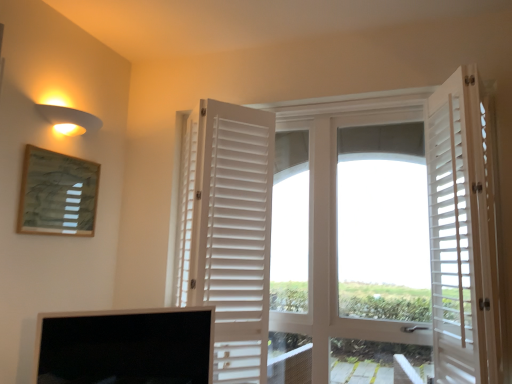
Question: Is the surface of wooden textured picture frame at upper left in direct contact with white wooden shutters at right, positioned as the first door in right-to-left order?

Choices:
 (A) no
 (B) yes

Answer: (A)

Question: Is wooden textured picture frame at upper left not close to white wooden shutters at right, positioned as the first door in right-to-left order?

Choices:
 (A) no
 (B) yes

Answer: (B)

Question: Is white wooden shutters at right, positioned as the first door in right-to-left order, completely or partially inside wooden textured picture frame at upper left?

Choices:
 (A) yes
 (B) no

Answer: (B)

Question: Considering the relative positions of wooden textured picture frame at upper left and white wooden shutters at right, acting as the 3th door starting from the left, in the image provided, is wooden textured picture frame at upper left to the left of white wooden shutters at right, acting as the 3th door starting from the left, from the viewer's perspective?

Choices:
 (A) no
 (B) yes

Answer: (B)

Question: Does wooden textured picture frame at upper left have a larger size compared to white wooden shutters at right, acting as the 3th door starting from the left?

Choices:
 (A) no
 (B) yes

Answer: (A)

Question: In terms of size, does wooden textured picture frame at upper left appear bigger or smaller than matte yellow wall sconce at upper left?

Choices:
 (A) small
 (B) big

Answer: (B)

Question: Considering their positions, is wooden textured picture frame at upper left located in front of or behind matte yellow wall sconce at upper left?

Choices:
 (A) behind
 (B) front

Answer: (B)

Question: Would you say wooden textured picture frame at upper left is to the left or to the right of matte yellow wall sconce at upper left in the picture?

Choices:
 (A) left
 (B) right

Answer: (A)

Question: From the image's perspective, is wooden textured picture frame at upper left above or below matte yellow wall sconce at upper left?

Choices:
 (A) below
 (B) above

Answer: (A)

Question: Considering their positions, is white matte shutters at center, which is counted as the 1th door, starting from the left, located in front of or behind matte yellow wall sconce at upper left?

Choices:
 (A) behind
 (B) front

Answer: (B)

Question: In terms of size, does white matte shutters at center, the 3th door positioned from the right, appear bigger or smaller than matte yellow wall sconce at upper left?

Choices:
 (A) big
 (B) small

Answer: (A)

Question: Looking at their shapes, would you say white matte shutters at center, the 3th door positioned from the right, is wider or thinner than matte yellow wall sconce at upper left?

Choices:
 (A) wide
 (B) thin

Answer: (A)

Question: Is white matte shutters at center, which is counted as the 1th door, starting from the left, inside or outside of matte yellow wall sconce at upper left?

Choices:
 (A) inside
 (B) outside

Answer: (B)

Question: Relative to black glossy screen at lower left, is wooden textured picture frame at upper left in front or behind?

Choices:
 (A) behind
 (B) front

Answer: (A)

Question: Is point pos(93,165) closer or farther from the camera than point pos(168,327)?

Choices:
 (A) farther
 (B) closer

Answer: (A)